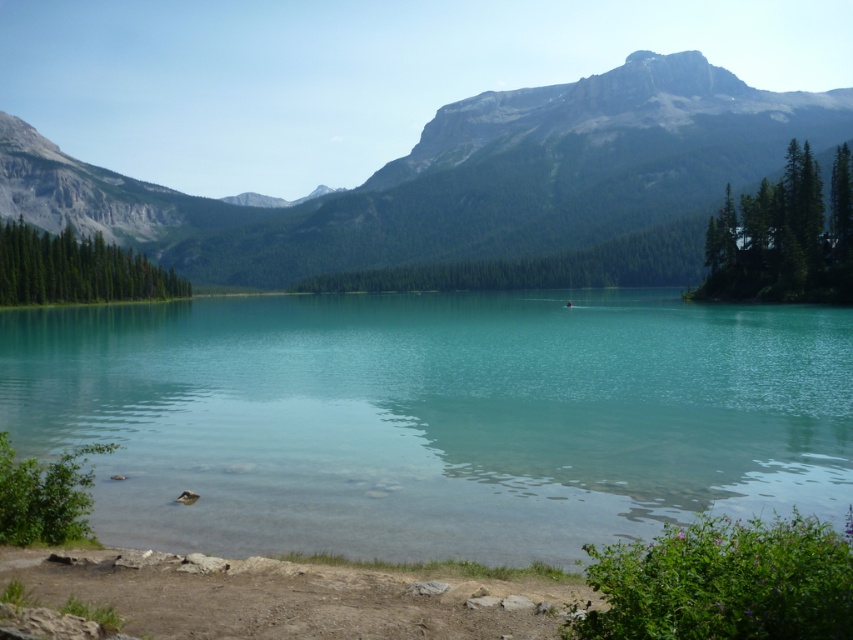
Is green rock mountain at upper center taller than dull brown dirt at lower center?

Yes, green rock mountain at upper center is taller than dull brown dirt at lower center.

Which is in front, point (463, 172) or point (413, 632)?

Point (413, 632) is in front.

Locate an element on the screen. This screenshot has height=640, width=853. green rock mountain at upper center is located at coordinates (459, 177).

Can you confirm if clear glass water at center is wider than green rock mountain at upper center?

No.

Which is in front, point (152, 513) or point (300, 257)?

Point (152, 513)

Where is `clear glass water at center`? The width and height of the screenshot is (853, 640). clear glass water at center is located at coordinates (434, 417).

Is clear glass water at center wider than dull brown dirt at lower center?

Yes, clear glass water at center is wider than dull brown dirt at lower center.

Who is shorter, clear glass water at center or dull brown dirt at lower center?

With less height is dull brown dirt at lower center.

Is point (780, 492) farther from viewer compared to point (218, 579)?

Yes, point (780, 492) is farther from viewer.

This screenshot has width=853, height=640. I want to click on clear glass water at center, so click(434, 417).